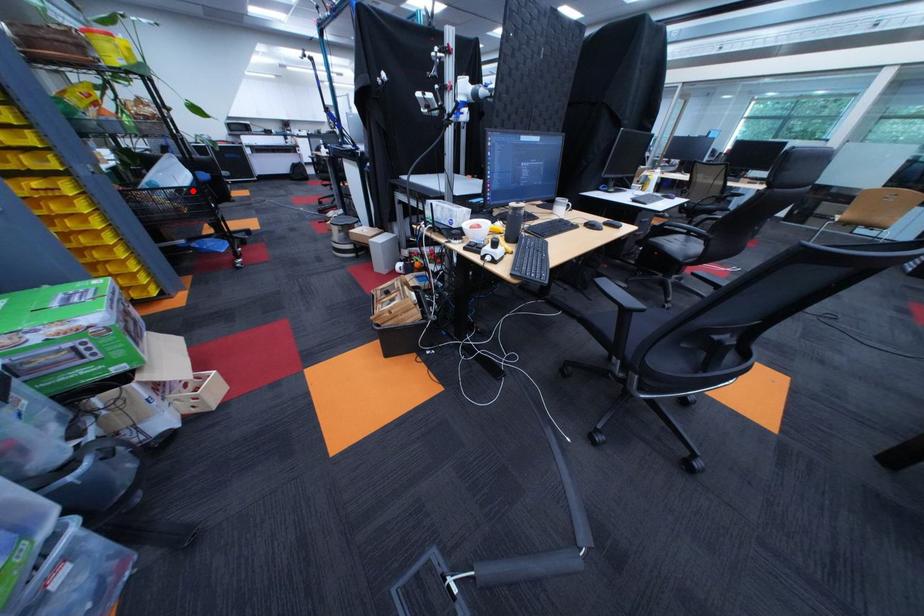
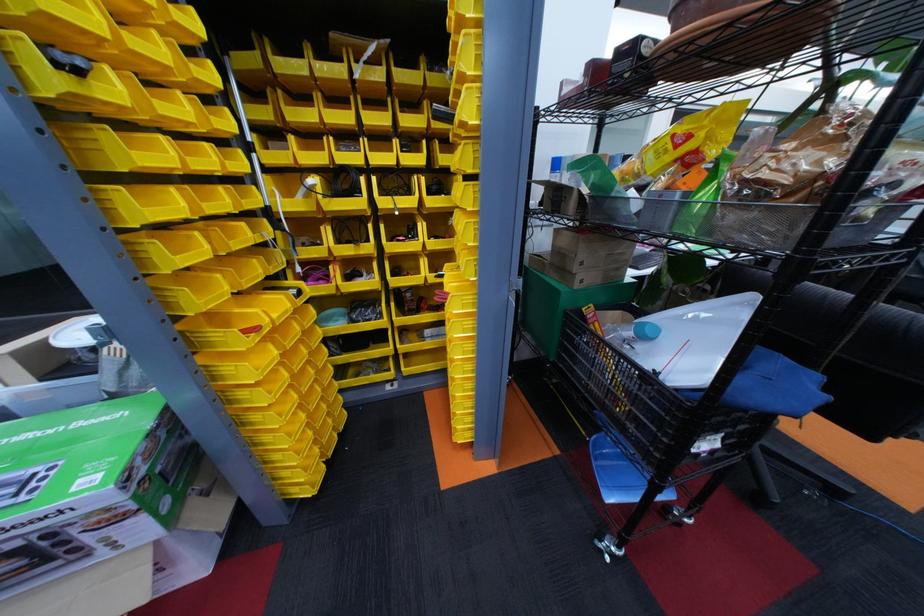
In the second image, find the point that corresponds to the highlighted location in the first image.

(662, 378)